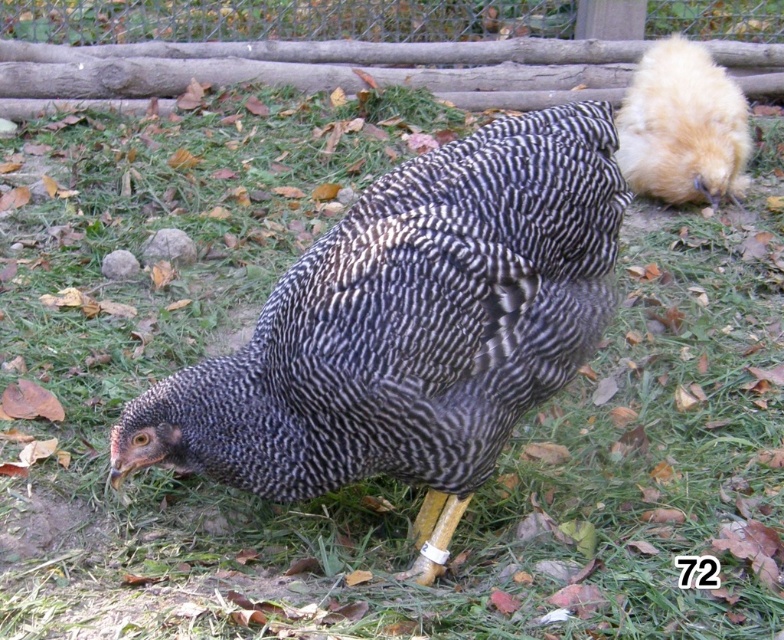
Question: Which point is closer to the camera taking this photo?

Choices:
 (A) pyautogui.click(x=637, y=93)
 (B) pyautogui.click(x=449, y=412)
 (C) pyautogui.click(x=314, y=61)

Answer: (B)

Question: Is speckled feathered chicken at center thinner than golden fluffy chicken at upper right?

Choices:
 (A) yes
 (B) no

Answer: (B)

Question: Does speckled feathered chicken at center have a smaller size compared to golden fluffy chicken at upper right?

Choices:
 (A) no
 (B) yes

Answer: (A)

Question: Which of these objects is positioned closest to the speckled feathered chicken at center?

Choices:
 (A) golden fluffy chicken at upper right
 (B) wooden fence at upper center

Answer: (A)

Question: Among these points, which one is farthest from the camera?

Choices:
 (A) (311, 260)
 (B) (74, 84)
 (C) (677, 154)

Answer: (B)

Question: Does speckled feathered chicken at center have a larger size compared to wooden fence at upper center?

Choices:
 (A) no
 (B) yes

Answer: (A)